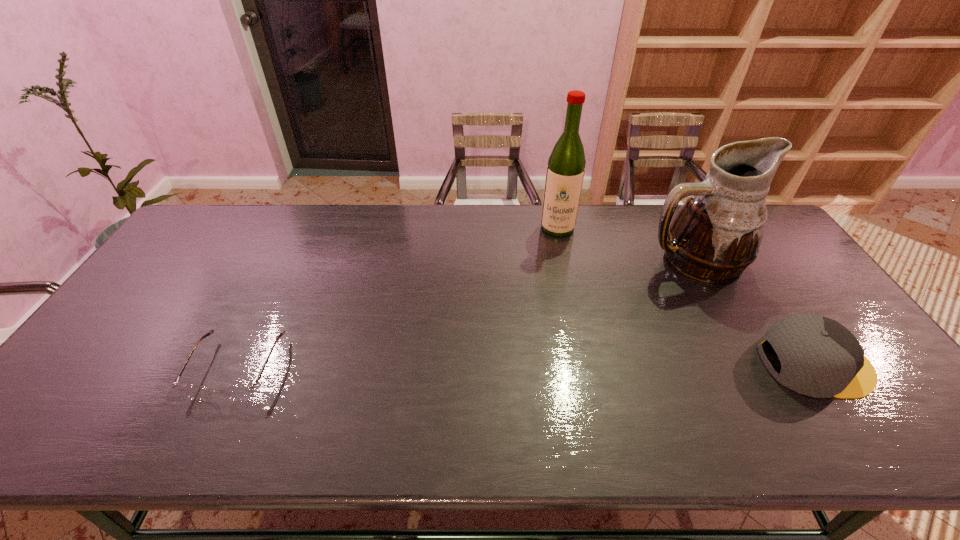
Image resolution: width=960 pixels, height=540 pixels. I want to click on free space between the pitcher and the leftmost object, so click(x=465, y=315).

You are a GUI agent. You are given a task and a screenshot of the screen. Output one action in this format:
    pyautogui.click(x=<x>, y=<y>)
    Task: Click on the vacant space in between the third tallest object and the spectacles
    This screenshot has width=960, height=540.
    Given the screenshot: What is the action you would take?
    pyautogui.click(x=527, y=366)

What are the coordinates of `vacant area that lies between the liquor and the third tallest object` in the screenshot? It's located at coord(686,296).

Locate which object is the third closest to the cap. Please provide its 2D coordinates. Your answer should be formatted as a tuple, i.e. [(x, y)], where the tuple contains the x and y coordinates of a point satisfying the conditions above.

[(236, 392)]

What are the coordinates of `the closest object to the third tallest object` in the screenshot? It's located at pos(716,234).